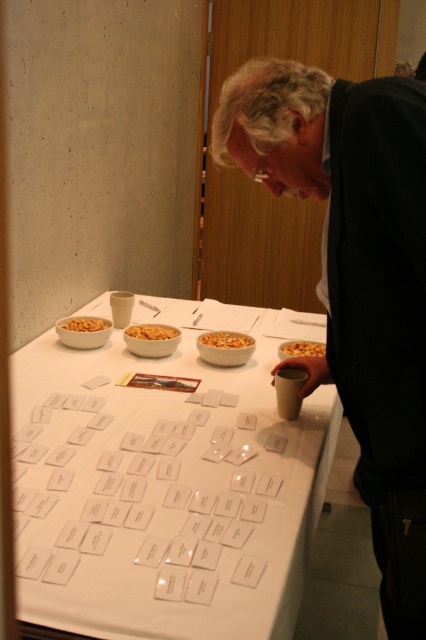
Question: Among these points, which one is nearest to the camera?

Choices:
 (A) (236, 387)
 (B) (204, 344)
 (C) (77, 328)

Answer: (A)

Question: Is golden crunchy cereal at center thinner than smooth white bowl at center?

Choices:
 (A) no
 (B) yes

Answer: (B)

Question: Which point appears closest to the camera in this image?

Choices:
 (A) (28, 532)
 (B) (71, 326)
 (C) (414, 419)
 (D) (143, 330)

Answer: (C)

Question: Is the position of matte black cup at center more distant than that of smooth white bowl at center?

Choices:
 (A) yes
 (B) no

Answer: (B)

Question: Which object is positioned closest to the golden crunchy cereal at center?

Choices:
 (A) matte black cup at center
 (B) smooth white bowl at center

Answer: (B)

Question: Is white paper cards at center to the left of smooth white bowl at center from the viewer's perspective?

Choices:
 (A) yes
 (B) no

Answer: (B)